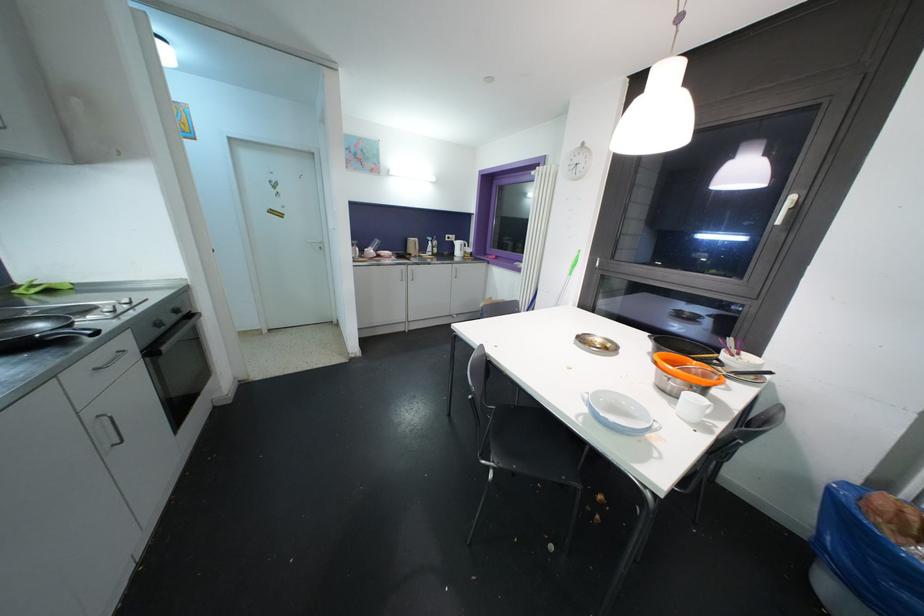
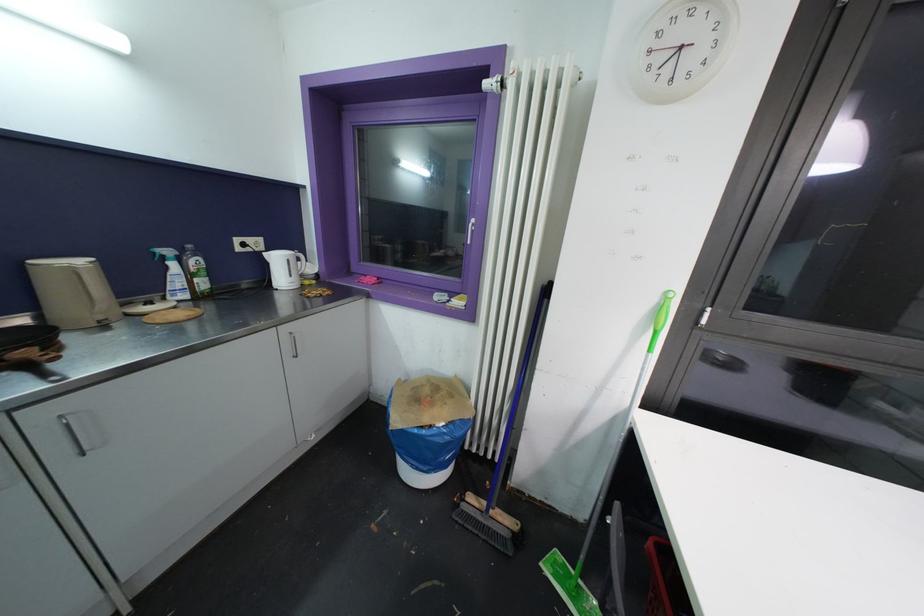
In the second image, find the point that corresponds to (460,246) in the first image.

(281, 262)